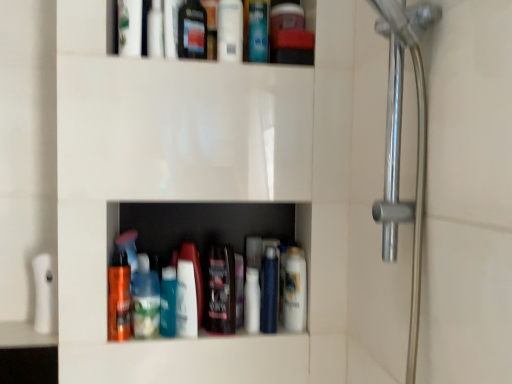
Question: Which direction should I rotate to look at white glossy lotion at center, the 2th toiletry viewed from the top?

Choices:
 (A) left
 (B) right

Answer: (A)

Question: Is translucent plastic mouthwash at lower center, the seventh mouthwash from the right, aimed at white glossy lotion at center, which is the first toiletry from right to left?

Choices:
 (A) no
 (B) yes

Answer: (A)

Question: From the image's perspective, is translucent plastic mouthwash at lower center, which appears as the 2th mouthwash when viewed from the left, below white glossy lotion at center, which appears as the 1th toiletry when ordered from the bottom?

Choices:
 (A) yes
 (B) no

Answer: (A)

Question: Is translucent plastic mouthwash at lower center, which appears as the 2th mouthwash when viewed from the left, to the left of white glossy lotion at center, acting as the second toiletry starting from the left, from the viewer's perspective?

Choices:
 (A) yes
 (B) no

Answer: (A)

Question: Is translucent plastic mouthwash at lower center, the seventh mouthwash from the right, not inside white glossy lotion at center, the 2th toiletry viewed from the top?

Choices:
 (A) yes
 (B) no

Answer: (A)

Question: Is the position of translucent plastic mouthwash at lower center, the seventh mouthwash from the right, more distant than that of white glossy lotion at center, the 2th toiletry viewed from the top?

Choices:
 (A) no
 (B) yes

Answer: (A)

Question: Can you confirm if translucent plastic mouthwash at lower center, the seventh mouthwash from the right, is positioned to the right of white glossy lotion at center, which is the first toiletry from right to left?

Choices:
 (A) yes
 (B) no

Answer: (B)

Question: Is blue glossy mouthwash at center, the 2th mouthwash viewed from the right, facing away from translucent plastic bottle at center?

Choices:
 (A) no
 (B) yes

Answer: (A)

Question: Does blue glossy mouthwash at center, the 2th mouthwash viewed from the right, come behind translucent plastic bottle at center?

Choices:
 (A) yes
 (B) no

Answer: (A)

Question: From the image's perspective, is blue glossy mouthwash at center, positioned as the 7th mouthwash in left-to-right order, on top of translucent plastic bottle at center?

Choices:
 (A) no
 (B) yes

Answer: (B)

Question: Considering the relative sizes of blue glossy mouthwash at center, the 2th mouthwash viewed from the right, and translucent plastic bottle at center in the image provided, is blue glossy mouthwash at center, the 2th mouthwash viewed from the right, shorter than translucent plastic bottle at center?

Choices:
 (A) no
 (B) yes

Answer: (A)

Question: Considering the relative sizes of blue glossy mouthwash at center, positioned as the 7th mouthwash in left-to-right order, and translucent plastic bottle at center in the image provided, is blue glossy mouthwash at center, positioned as the 7th mouthwash in left-to-right order, wider than translucent plastic bottle at center?

Choices:
 (A) yes
 (B) no

Answer: (A)

Question: Is blue glossy mouthwash at center, the 2th mouthwash viewed from the right, outside of translucent plastic bottle at center?

Choices:
 (A) yes
 (B) no

Answer: (A)

Question: Does shiny orange bottle at lower center, which is counted as the 1th mouthwash, starting from the left, have a lesser width compared to white glossy lotion at center, acting as the second toiletry starting from the left?

Choices:
 (A) no
 (B) yes

Answer: (B)